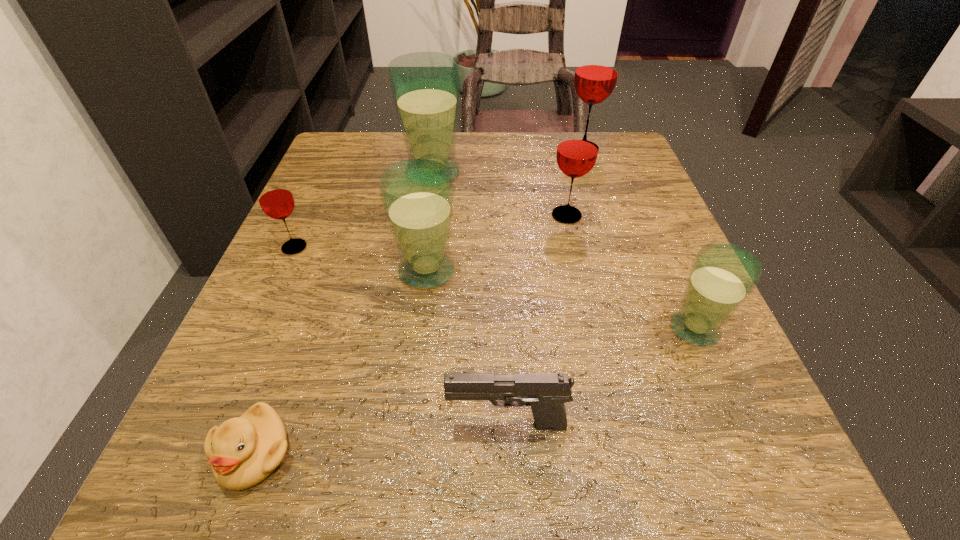
Where is `free region located aim along the barrel of the pistol`? The height and width of the screenshot is (540, 960). free region located aim along the barrel of the pistol is located at coordinates (212, 424).

Locate an element on the screen. This screenshot has width=960, height=540. object present at the near edge is located at coordinates (243, 451).

At what (x,y) coordinates should I click in order to perform the action: click on glass present at the left edge. Please return your answer as a coordinate pair (x, y). Image resolution: width=960 pixels, height=540 pixels. Looking at the image, I should click on (275, 198).

Locate an element on the screen. The image size is (960, 540). duckling that is at the left edge is located at coordinates (243, 451).

Where is `object positioned at the near left corner`? Image resolution: width=960 pixels, height=540 pixels. object positioned at the near left corner is located at coordinates (243, 451).

Image resolution: width=960 pixels, height=540 pixels. I want to click on object that is at the far right corner, so click(596, 73).

This screenshot has height=540, width=960. In the image, there is a desktop. Identify the location of vacant space at the far edge. (483, 141).

At what (x,y) coordinates should I click in order to perform the action: click on vacant space at the near edge. Please return your answer as a coordinate pair (x, y). The width and height of the screenshot is (960, 540). Looking at the image, I should click on (361, 467).

Locate an element on the screen. vacant space at the left edge of the desktop is located at coordinates (291, 300).

The image size is (960, 540). In order to click on vacant space at the right edge of the desktop in this screenshot , I will do `click(612, 288)`.